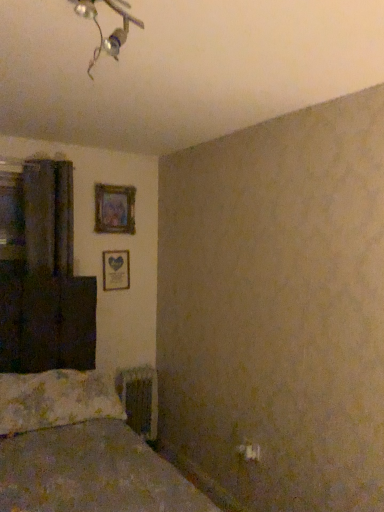
Question: Considering the relative positions of wooden picture frame at center-left, which appears as the second picture frame when viewed from the top, and metallic radiator at lower center in the image provided, is wooden picture frame at center-left, which appears as the second picture frame when viewed from the top, to the left or to the right of metallic radiator at lower center?

Choices:
 (A) right
 (B) left

Answer: (B)

Question: Is wooden picture frame at center-left, the first picture frame from the bottom, inside the boundaries of metallic radiator at lower center, or outside?

Choices:
 (A) outside
 (B) inside

Answer: (A)

Question: Based on their relative distances, which object is farther from the dark matte curtain at left?

Choices:
 (A) wooden frame at upper center, acting as the first picture frame starting from the top
 (B) wooden picture frame at center-left, the first picture frame from the bottom
 (C) metallic silver light fixture at upper center
 (D) fluffy white pillow at lower left
 (E) metallic radiator at lower center

Answer: (C)

Question: Based on their relative distances, which object is nearer to the fluffy white pillow at lower left?

Choices:
 (A) wooden frame at upper center, the 2th picture frame ordered from the bottom
 (B) metallic radiator at lower center
 (C) metallic silver light fixture at upper center
 (D) dark matte curtain at left
 (E) wooden picture frame at center-left, which appears as the second picture frame when viewed from the top

Answer: (B)